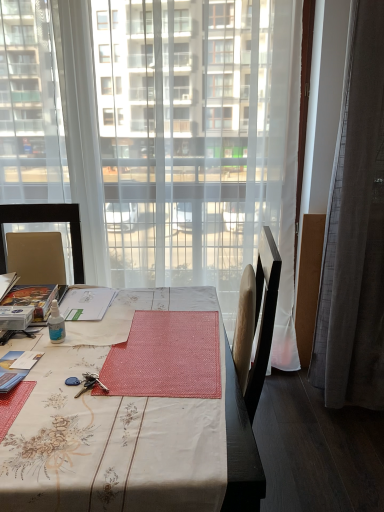
Where is `free space in front of transparent plastic bottle at table center`? The height and width of the screenshot is (512, 384). free space in front of transparent plastic bottle at table center is located at coordinates (55, 366).